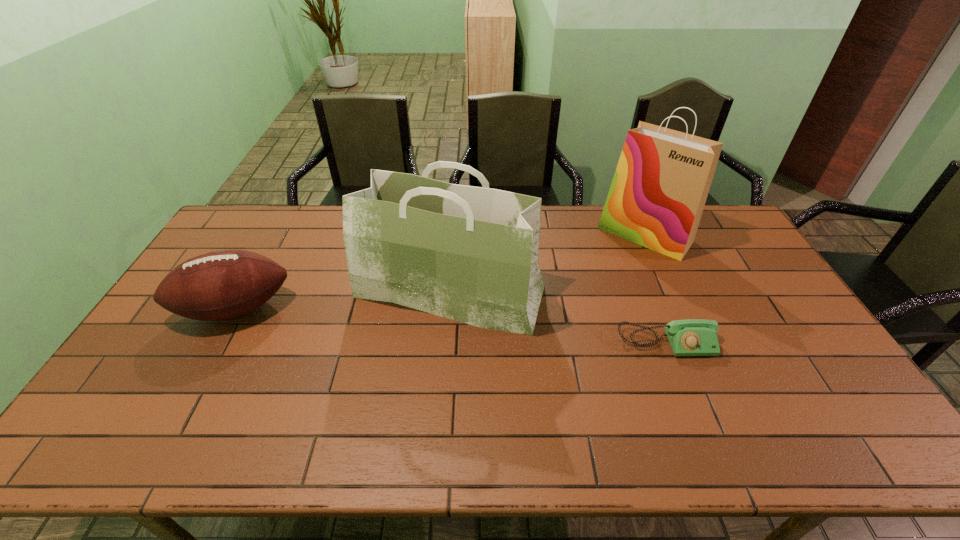
Find the location of a particular element. Image resolution: width=960 pixels, height=540 pixels. vacant point located between the grocery bag and the shopping bag is located at coordinates (547, 262).

I want to click on vacant area that lies between the third object from right to left and the leftmost object, so click(343, 300).

The height and width of the screenshot is (540, 960). In order to click on vacant area between the shortest object and the shopping bag in this screenshot , I will do `click(656, 288)`.

I want to click on free space between the telephone and the second shortest object, so click(x=450, y=326).

Identify the location of empty location between the telephone and the shopping bag. The height and width of the screenshot is (540, 960). (656, 288).

The height and width of the screenshot is (540, 960). I want to click on object that is the nearest to the grocery bag, so click(x=221, y=285).

You are a GUI agent. You are given a task and a screenshot of the screen. Output one action in this format:
    pyautogui.click(x=<x>, y=<y>)
    Task: Click on the closest object to the telephone
    
    Given the screenshot: What is the action you would take?
    (x=470, y=254)

Identify the location of vacant region that satisfies the following two spatial constraints: 1. on the back side of the grocery bag; 2. on the right side of the shopping bag. (454, 234).

The image size is (960, 540). Identify the location of free point that satisfies the following two spatial constraints: 1. on the back side of the third tallest object; 2. on the left side of the shopping bag. (276, 234).

The height and width of the screenshot is (540, 960). Find the location of `vacant space that satisfies the following two spatial constraints: 1. on the back side of the third object from right to left; 2. on the right side of the shopping bag`. vacant space that satisfies the following two spatial constraints: 1. on the back side of the third object from right to left; 2. on the right side of the shopping bag is located at coordinates (454, 234).